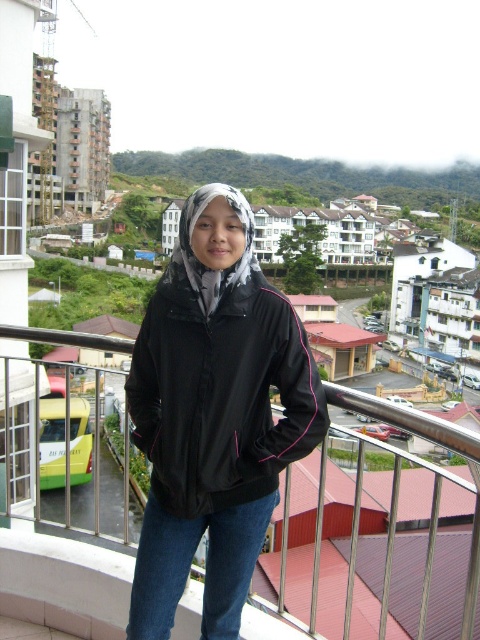
You are a photographer trying to capture the person in the black synthetic jacket at center without including the metallic silver railing at upper center in the frame. Is this possible based on their positions?

The metallic silver railing at upper center is behind the black synthetic jacket at center, so the photographer can position the camera to focus on the jacket without the railing appearing in the frame.

You are trying to determine the spatial relationship between the metallic silver railing at upper center and the blue denim jeans at lower center. Based on the scene, which object is closer to the viewer?

The blue denim jeans at lower center are closer to the viewer than the metallic silver railing at upper center because the railing is positioned behind the jeans.

You are standing on the balcony and want to look at the two points marked in the image. Which point is closer to you, point (159, 492) or point (100, 337)?

Point (159, 492) is in front of point (100, 337), so it is closer to you.